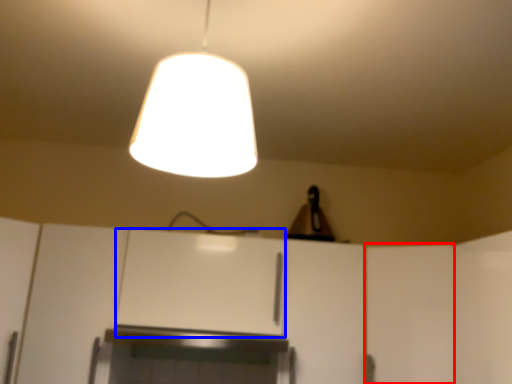
Question: Among these objects, which one is farthest to the camera, door (highlighted by a red box) or cabinetry (highlighted by a blue box)?

Choices:
 (A) door
 (B) cabinetry

Answer: (B)